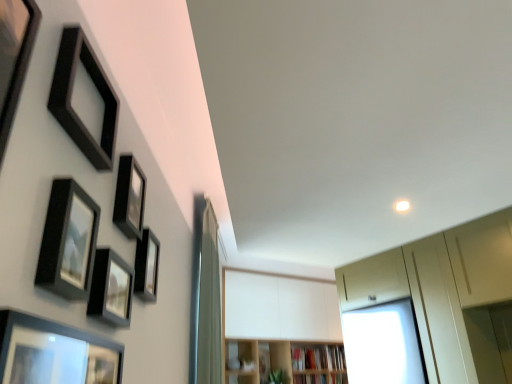
Question: Is matte black picture frame at upper left, acting as the third picture frame starting from the back, far away from matte black picture frame at center-left, arranged as the 1th picture frame when viewed from the back?

Choices:
 (A) no
 (B) yes

Answer: (A)

Question: Considering the relative sizes of matte black picture frame at upper left, marked as the 4th picture frame in a front-to-back arrangement, and matte black picture frame at center-left, arranged as the 1th picture frame when viewed from the back, in the image provided, is matte black picture frame at upper left, marked as the 4th picture frame in a front-to-back arrangement, taller than matte black picture frame at center-left, arranged as the 1th picture frame when viewed from the back,?

Choices:
 (A) yes
 (B) no

Answer: (B)

Question: From a real-world perspective, is matte black picture frame at upper left, marked as the 4th picture frame in a front-to-back arrangement, on matte black picture frame at center-left, positioned as the sixth picture frame in front-to-back order?

Choices:
 (A) no
 (B) yes

Answer: (A)

Question: Is matte black picture frame at upper left, marked as the 4th picture frame in a front-to-back arrangement, facing away from matte black picture frame at center-left, arranged as the 1th picture frame when viewed from the back?

Choices:
 (A) no
 (B) yes

Answer: (A)

Question: Is matte black picture frame at upper left, marked as the 4th picture frame in a front-to-back arrangement, not inside matte black picture frame at center-left, arranged as the 1th picture frame when viewed from the back?

Choices:
 (A) no
 (B) yes

Answer: (B)

Question: Is black matte picture frame at upper left, which appears as the 3th picture frame when viewed from the front, taller or shorter than matte black picture frame at upper left, marked as the 4th picture frame in a front-to-back arrangement?

Choices:
 (A) short
 (B) tall

Answer: (B)

Question: Considering the positions of black matte picture frame at upper left, which is the fourth picture frame in back-to-front order, and matte black picture frame at upper left, marked as the 4th picture frame in a front-to-back arrangement, in the image, is black matte picture frame at upper left, which is the fourth picture frame in back-to-front order, wider or thinner than matte black picture frame at upper left, marked as the 4th picture frame in a front-to-back arrangement,?

Choices:
 (A) wide
 (B) thin

Answer: (B)

Question: Based on their positions, is black matte picture frame at upper left, which appears as the 3th picture frame when viewed from the front, located to the left or right of matte black picture frame at upper left, marked as the 4th picture frame in a front-to-back arrangement?

Choices:
 (A) right
 (B) left

Answer: (B)

Question: Is point (72, 28) closer or farther from the camera than point (120, 258)?

Choices:
 (A) closer
 (B) farther

Answer: (A)

Question: From a real-world perspective, is matte black picture frame at upper left, the second picture frame viewed from the front, physically located above or below matte black picture frame at lower left, the 6th picture frame viewed from the back?

Choices:
 (A) above
 (B) below

Answer: (A)

Question: From the image's perspective, is matte black picture frame at upper left, the second picture frame viewed from the front, positioned above or below matte black picture frame at lower left, the 1th picture frame viewed from the front?

Choices:
 (A) below
 (B) above

Answer: (B)

Question: Would you say matte black picture frame at upper left, the second picture frame viewed from the front, is to the left or to the right of matte black picture frame at lower left, the 6th picture frame viewed from the back, in the picture?

Choices:
 (A) left
 (B) right

Answer: (A)

Question: Would you say matte black picture frame at upper left, the second picture frame viewed from the front, is inside or outside matte black picture frame at lower left, the 6th picture frame viewed from the back?

Choices:
 (A) outside
 (B) inside

Answer: (A)

Question: Is point (153, 276) positioned closer to the camera than point (96, 81)?

Choices:
 (A) closer
 (B) farther

Answer: (B)

Question: From a real-world perspective, is matte black picture frame at center-left, arranged as the 1th picture frame when viewed from the back, above or below black matte picture frame at upper left, which appears as the 3th picture frame when viewed from the front?

Choices:
 (A) above
 (B) below

Answer: (B)